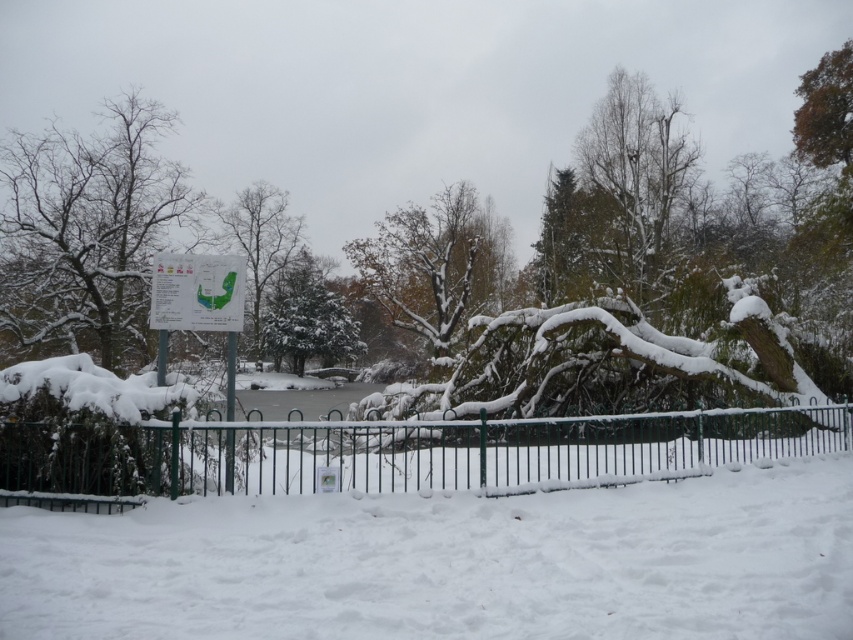
Is green metal fence at center thinner than snow-covered bare tree at left?

Correct, green metal fence at center's width is less than snow-covered bare tree at left's.

At what (x,y) coordinates should I click in order to perform the action: click on green metal fence at center. Please return your answer as a coordinate pair (x, y). Looking at the image, I should click on (399, 451).

Find the location of `green metal fence at center`. green metal fence at center is located at coordinates (399, 451).

Does point (299, 220) come closer to viewer compared to point (828, 93)?

No, (299, 220) is behind (828, 93).

I want to click on white snow-covered tree at center, so click(259, 241).

Find the location of a particular element. This screenshot has width=853, height=640. white snow-covered tree at center is located at coordinates (259, 241).

At what (x,y) coordinates should I click in order to perform the action: click on white snow-covered tree at center. Please return your answer as a coordinate pair (x, y). Looking at the image, I should click on (259, 241).

Can you confirm if snow-covered bare tree at left is wider than brown textured tree at upper right?

Indeed, snow-covered bare tree at left has a greater width compared to brown textured tree at upper right.

Is point (144, 99) positioned in front of point (840, 83)?

No, (144, 99) is further to viewer.

Who is more distant from viewer, (181,209) or (819,148)?

The point (819,148) is behind.

Find the location of a particular element. This screenshot has width=853, height=640. snow-covered bare tree at left is located at coordinates (88, 234).